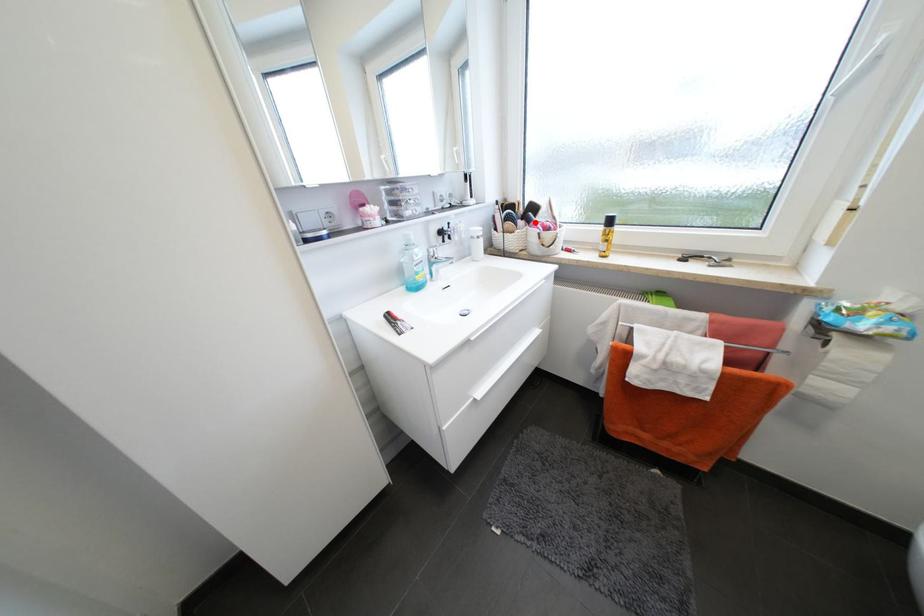
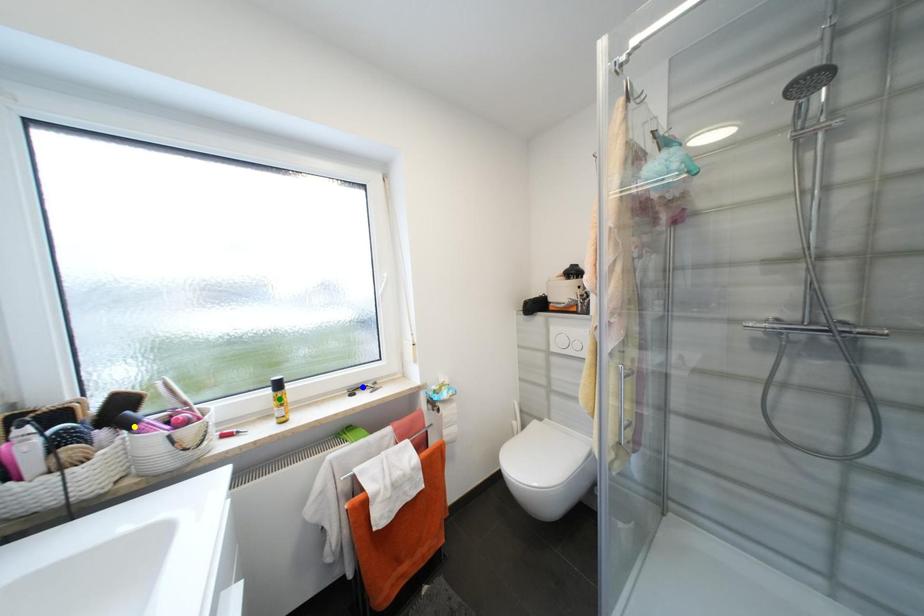
Question: I am providing you with two images of the same scene from different viewpoints. A red point is marked on the first image. You are given multiple points on the second image. Which spot in image 2 lines up with the point in image 1?

Choices:
 (A) blue point
 (B) green point
 (C) yellow point

Answer: (C)